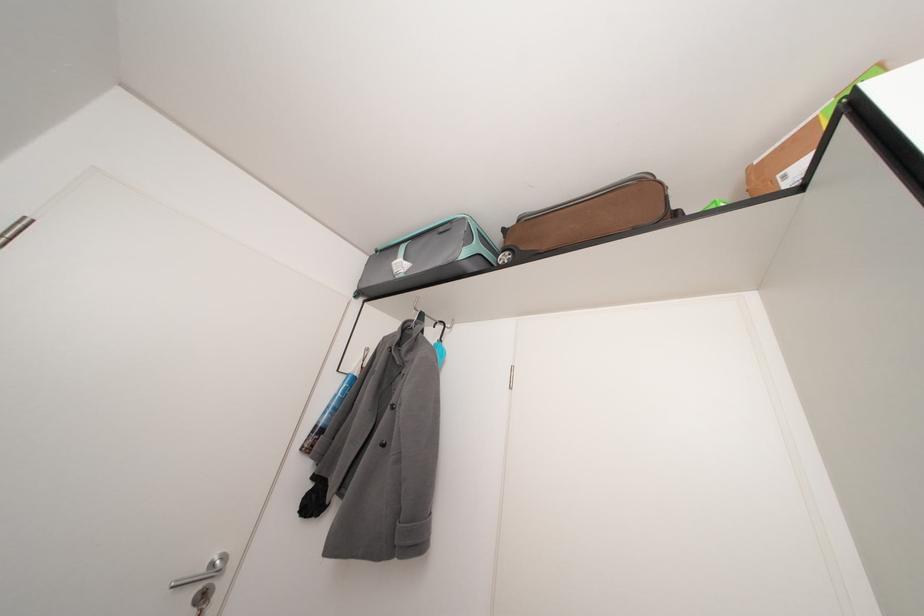
Find where to lift the cardboard box. Please return your answer as a coordinate pair (x, y).

(796, 146)